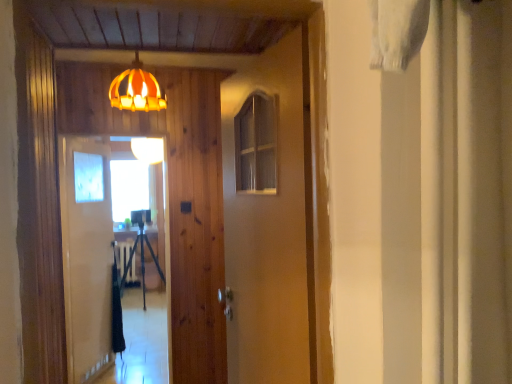
Find the location of a particular element. Image resolution: width=512 pixels, height=384 pixels. wooden barn door at center is located at coordinates (268, 231).

Where is `matte orange lampshade at upper center, placed as the second lamp when sorted from front to back`? matte orange lampshade at upper center, placed as the second lamp when sorted from front to back is located at coordinates (148, 149).

From the image's perspective, does clear glass screen door at center, positioned as the second screen door in front-to-back order, appear higher than clear glass screen door at center, the second screen door viewed from the back?

Yes, from the image's perspective, clear glass screen door at center, positioned as the second screen door in front-to-back order, is on top of clear glass screen door at center, the second screen door viewed from the back.

Could you tell me if clear glass screen door at center, which is the 1th screen door from back to front, is facing clear glass screen door at center, placed as the first screen door when sorted from front to back?

Yes, clear glass screen door at center, which is the 1th screen door from back to front, is oriented towards clear glass screen door at center, placed as the first screen door when sorted from front to back.

Is clear glass screen door at center, which is the 1th screen door from back to front, closer to the viewer compared to clear glass screen door at center, placed as the first screen door when sorted from front to back?

No, it is behind clear glass screen door at center, placed as the first screen door when sorted from front to back.

Considering the relative sizes of clear glass screen door at center, which is the 1th screen door from back to front, and clear glass screen door at center, the second screen door viewed from the back, in the image provided, is clear glass screen door at center, which is the 1th screen door from back to front, shorter than clear glass screen door at center, the second screen door viewed from the back,?

In fact, clear glass screen door at center, which is the 1th screen door from back to front, may be taller than clear glass screen door at center, the second screen door viewed from the back.

Is clear glass screen door at center, which is the 1th screen door from back to front, placed right next to matte orange lampshade at upper center, which is counted as the second lamp, starting from the left?

There is a gap between clear glass screen door at center, which is the 1th screen door from back to front, and matte orange lampshade at upper center, which is counted as the second lamp, starting from the left.

Is clear glass screen door at center, positioned as the second screen door in front-to-back order, positioned with its back to matte orange lampshade at upper center, arranged as the 2th lamp when viewed from the back?

No, matte orange lampshade at upper center, arranged as the 2th lamp when viewed from the back, is not at the back of clear glass screen door at center, positioned as the second screen door in front-to-back order.

Which is closer, (70, 337) or (140, 72)?

Point (70, 337) appears to be farther away from the viewer than point (140, 72).

Does clear glass screen door at center, which is the 1th screen door from back to front, have a larger size compared to matte orange lampshade at upper center, arranged as the 2th lamp when viewed from the back?

Yes, clear glass screen door at center, which is the 1th screen door from back to front, is bigger than matte orange lampshade at upper center, arranged as the 2th lamp when viewed from the back.

Considering the relative positions of dark green fabric at center and matte orange lampshade at upper center, placed as the second lamp when sorted from front to back, in the image provided, is dark green fabric at center to the right of matte orange lampshade at upper center, placed as the second lamp when sorted from front to back, from the viewer's perspective?

No.

Can you confirm if dark green fabric at center is thinner than matte orange lampshade at upper center, placed as the second lamp when sorted from front to back?

No, dark green fabric at center is not thinner than matte orange lampshade at upper center, placed as the second lamp when sorted from front to back.

Is point (136, 313) behind point (145, 156)?

Yes, it is behind point (145, 156).

From the image's perspective, is dark green fabric at center on matte orange lampshade at upper center, arranged as the 1th lamp when viewed from the back?

No, from the image's perspective, dark green fabric at center is not above matte orange lampshade at upper center, arranged as the 1th lamp when viewed from the back.

Can you see wooden barn door at center touching matte orange lampshade at upper center, arranged as the 2th lamp when viewed from the back?

No, wooden barn door at center is not with matte orange lampshade at upper center, arranged as the 2th lamp when viewed from the back.

Considering the relative sizes of wooden barn door at center and matte orange lampshade at upper center, the first lamp from the right, in the image provided, is wooden barn door at center wider than matte orange lampshade at upper center, the first lamp from the right,?

No.

Is wooden barn door at center bigger than matte orange lampshade at upper center, which is counted as the second lamp, starting from the left?

Yes, wooden barn door at center is bigger than matte orange lampshade at upper center, which is counted as the second lamp, starting from the left.

Does point (281, 380) come in front of point (113, 100)?

Yes, it is in front of point (113, 100).

Can you confirm if matte orange lampshade at upper center, arranged as the 2th lamp when viewed from the back, is positioned to the right of matte orange lampshade at upper center, arranged as the 1th lamp when viewed from the back?

Indeed, matte orange lampshade at upper center, arranged as the 2th lamp when viewed from the back, is positioned on the right side of matte orange lampshade at upper center, arranged as the 1th lamp when viewed from the back.

Is matte orange lampshade at upper center, the first lamp from the right, positioned in front of matte orange lampshade at upper center, placed as the second lamp when sorted from front to back?

Yes.

Can you confirm if matte orange lampshade at upper center, which is counted as the second lamp, starting from the left, is shorter than matte orange lampshade at upper center, the 2th lamp in the right-to-left sequence?

No.

Could you tell me if matte orange lampshade at upper center, arranged as the first lamp when viewed from the front, is facing matte orange lampshade at upper center, which is the first lamp in left-to-right order?

No, matte orange lampshade at upper center, arranged as the first lamp when viewed from the front, is not facing towards matte orange lampshade at upper center, which is the first lamp in left-to-right order.

Would you say matte orange lampshade at upper center, the first lamp from the right, contains clear glass screen door at center, placed as the first screen door when sorted from front to back?

Definitely not — clear glass screen door at center, placed as the first screen door when sorted from front to back, is not inside matte orange lampshade at upper center, the first lamp from the right.

From the picture: What's the angular difference between matte orange lampshade at upper center, which is counted as the second lamp, starting from the left, and clear glass screen door at center, placed as the first screen door when sorted from front to back,'s facing directions?

matte orange lampshade at upper center, which is counted as the second lamp, starting from the left, and clear glass screen door at center, placed as the first screen door when sorted from front to back, are facing 2.07 degrees away from each other.

From a real-world perspective, is matte orange lampshade at upper center, the first lamp from the right, located higher than clear glass screen door at center, placed as the first screen door when sorted from front to back?

Yes, from a real-world perspective, matte orange lampshade at upper center, the first lamp from the right, is on top of clear glass screen door at center, placed as the first screen door when sorted from front to back.

Can you see matte orange lampshade at upper center, arranged as the 2th lamp when viewed from the back, touching clear glass screen door at center, the second screen door viewed from the back?

No, matte orange lampshade at upper center, arranged as the 2th lamp when viewed from the back, is not next to clear glass screen door at center, the second screen door viewed from the back.

Considering the relative sizes of matte orange lampshade at upper center, which is the first lamp in left-to-right order, and matte orange lampshade at upper center, the first lamp from the right, in the image provided, is matte orange lampshade at upper center, which is the first lamp in left-to-right order, shorter than matte orange lampshade at upper center, the first lamp from the right,?

Yes, matte orange lampshade at upper center, which is the first lamp in left-to-right order, is shorter than matte orange lampshade at upper center, the first lamp from the right.

Can you tell me how much matte orange lampshade at upper center, which is the first lamp in left-to-right order, and matte orange lampshade at upper center, arranged as the first lamp when viewed from the front, differ in facing direction?

The angle between the facing direction of matte orange lampshade at upper center, which is the first lamp in left-to-right order, and the facing direction of matte orange lampshade at upper center, arranged as the first lamp when viewed from the front, is 0.418 degrees.

Is matte orange lampshade at upper center, arranged as the 1th lamp when viewed from the back, at the left side of matte orange lampshade at upper center, arranged as the 2th lamp when viewed from the back?

Correct, you'll find matte orange lampshade at upper center, arranged as the 1th lamp when viewed from the back, to the left of matte orange lampshade at upper center, arranged as the 2th lamp when viewed from the back.

From the image's perspective, between matte orange lampshade at upper center, placed as the second lamp when sorted from front to back, and matte orange lampshade at upper center, which is counted as the second lamp, starting from the left, which one is located above?

matte orange lampshade at upper center, which is counted as the second lamp, starting from the left.

Where is `screen door that appears below the clear glass screen door at center, positioned as the second screen door in front-to-back order (from the image's perspective)`? screen door that appears below the clear glass screen door at center, positioned as the second screen door in front-to-back order (from the image's perspective) is located at coordinates (108, 261).

Identify the location of the 2nd lamp above the clear glass screen door at center, which is the 1th screen door from back to front (from a real-world perspective). The image size is (512, 384). (137, 90).

Based on their spatial positions, is clear glass screen door at center, the second screen door viewed from the back, or matte orange lampshade at upper center, arranged as the 2th lamp when viewed from the back, further from wooden barn door at center?

The object further to wooden barn door at center is clear glass screen door at center, the second screen door viewed from the back.

From the image, which object appears to be farther from wooden barn door at center, dark green fabric at center or matte orange lampshade at upper center, the 2th lamp in the right-to-left sequence?

matte orange lampshade at upper center, the 2th lamp in the right-to-left sequence, is positioned further to the anchor wooden barn door at center.

Estimate the real-world distances between objects in this image. Which object is closer to matte orange lampshade at upper center, arranged as the 1th lamp when viewed from the back, clear glass screen door at center, placed as the first screen door when sorted from front to back, or matte orange lampshade at upper center, the first lamp from the right?

clear glass screen door at center, placed as the first screen door when sorted from front to back, is positioned closer to the anchor matte orange lampshade at upper center, arranged as the 1th lamp when viewed from the back.

Estimate the real-world distances between objects in this image. Which object is closer to clear glass screen door at center, placed as the first screen door when sorted from front to back, clear glass screen door at center, which is the 1th screen door from back to front, or matte orange lampshade at upper center, which is counted as the second lamp, starting from the left?

clear glass screen door at center, which is the 1th screen door from back to front, is positioned closer to the anchor clear glass screen door at center, placed as the first screen door when sorted from front to back.

Estimate the real-world distances between objects in this image. Which object is further from wooden barn door at center, dark green fabric at center or clear glass screen door at center, the second screen door viewed from the back?

dark green fabric at center lies further to wooden barn door at center than the other object.

From the image, which object appears to be farther from clear glass screen door at center, which is the 1th screen door from back to front, dark green fabric at center or clear glass screen door at center, the second screen door viewed from the back?

dark green fabric at center is positioned further to the anchor clear glass screen door at center, which is the 1th screen door from back to front.

From the image, which object appears to be farther from matte orange lampshade at upper center, arranged as the first lamp when viewed from the front, clear glass screen door at center, the second screen door viewed from the back, or matte orange lampshade at upper center, the 2th lamp in the right-to-left sequence?

Among the two, matte orange lampshade at upper center, the 2th lamp in the right-to-left sequence, is located further to matte orange lampshade at upper center, arranged as the first lamp when viewed from the front.

Estimate the real-world distances between objects in this image. Which object is further from dark green fabric at center, matte orange lampshade at upper center, arranged as the 2th lamp when viewed from the back, or wooden barn door at center?

The object further to dark green fabric at center is wooden barn door at center.

Locate an element on the screen. screen door between clear glass screen door at center, the second screen door viewed from the back, and matte orange lampshade at upper center, placed as the second lamp when sorted from front to back, from front to back is located at coordinates (87, 256).

Locate an element on the screen. This screenshot has width=512, height=384. screen door located between wooden barn door at center and dark green fabric at center in the depth direction is located at coordinates (108, 261).

At what (x,y) coordinates should I click in order to perform the action: click on screen door between wooden barn door at center and clear glass screen door at center, which is the 1th screen door from back to front, along the z-axis. Please return your answer as a coordinate pair (x, y). Looking at the image, I should click on (108, 261).

What are the coordinates of `lamp positioned between wooden barn door at center and clear glass screen door at center, which is the 1th screen door from back to front, from near to far` in the screenshot? It's located at (137, 90).